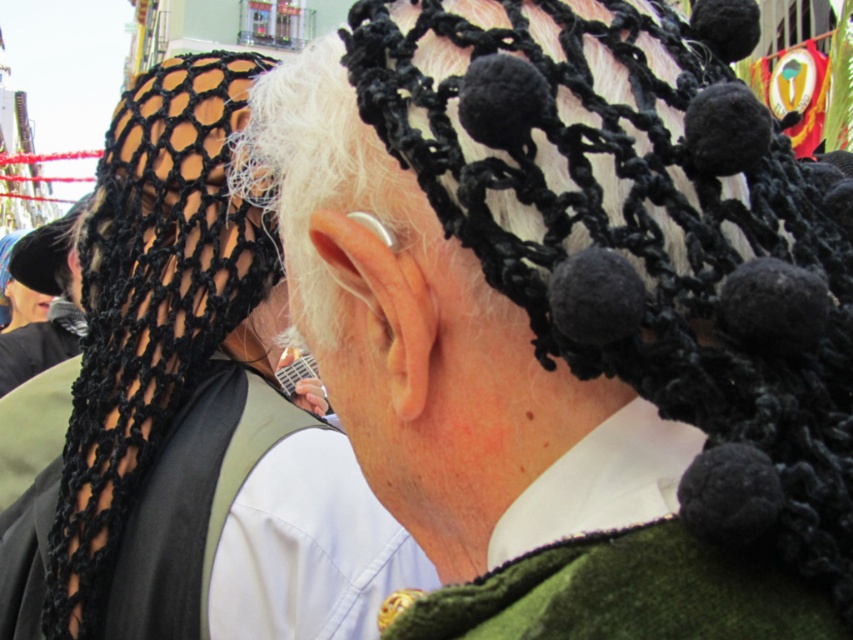
Question: Among these points, which one is nearest to the camera?

Choices:
 (A) (155, 268)
 (B) (293, 321)
 (C) (363, 540)

Answer: (B)

Question: Which point is closer to the camera taking this photo?

Choices:
 (A) (97, 237)
 (B) (757, 179)
 (C) (12, 605)

Answer: (B)

Question: Is black knitted hat at center to the right of black mesh headscarf at upper left from the viewer's perspective?

Choices:
 (A) yes
 (B) no

Answer: (A)

Question: Can you confirm if black knitted hat at center is smaller than black mesh headscarf at upper left?

Choices:
 (A) yes
 (B) no

Answer: (B)

Question: Is black knitted hat at center positioned at the back of black mesh headscarf at upper left?

Choices:
 (A) no
 (B) yes

Answer: (A)

Question: Among these objects, which one is nearest to the camera?

Choices:
 (A) black mesh headscarf at upper left
 (B) black knitted scarf at upper left
 (C) black knitted hat at center

Answer: (C)